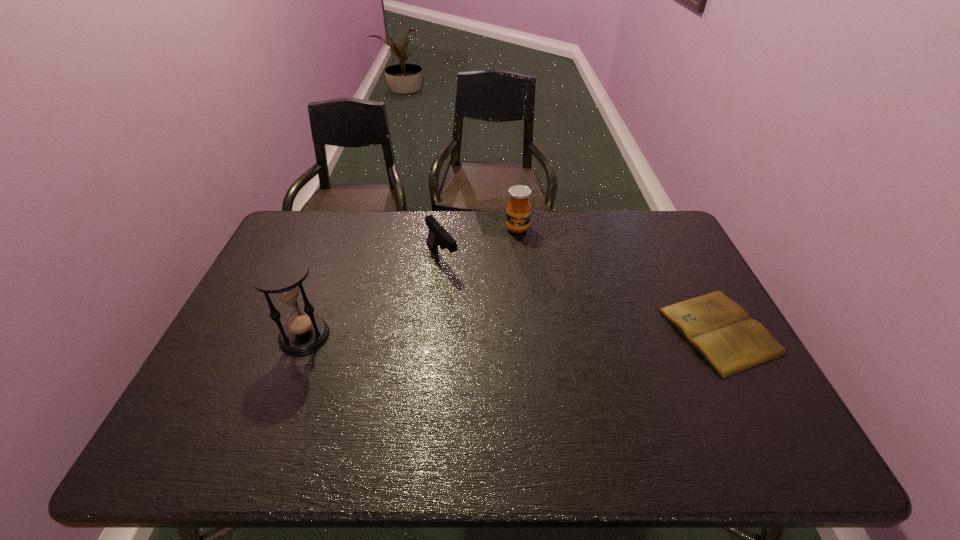
Locate an element on the screen. vacant space that satisfies the following two spatial constraints: 1. on the back side of the second farthest object; 2. on the left side of the second tallest object is located at coordinates (444, 228).